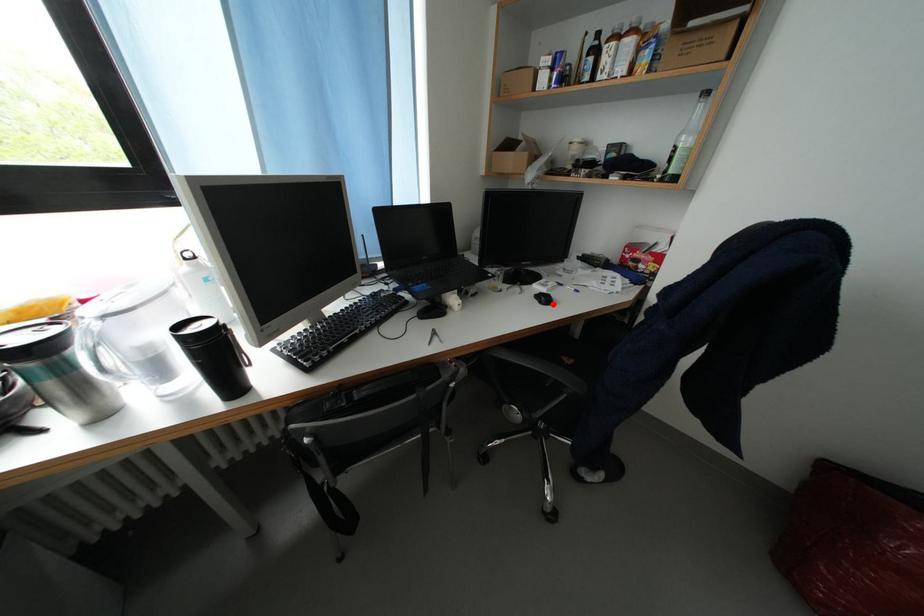
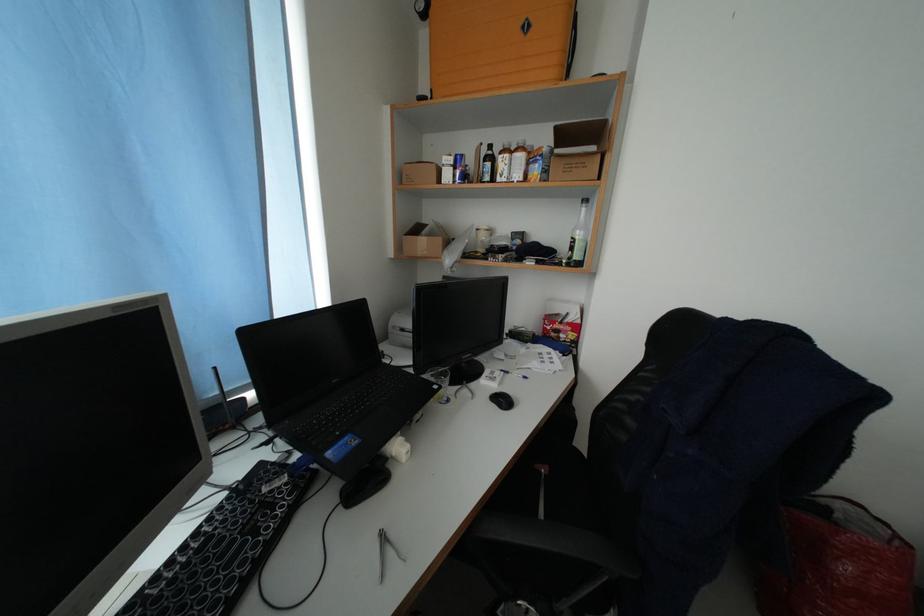
Where in the second image is the point corresponding to the highlighted location from the first image?

(512, 406)